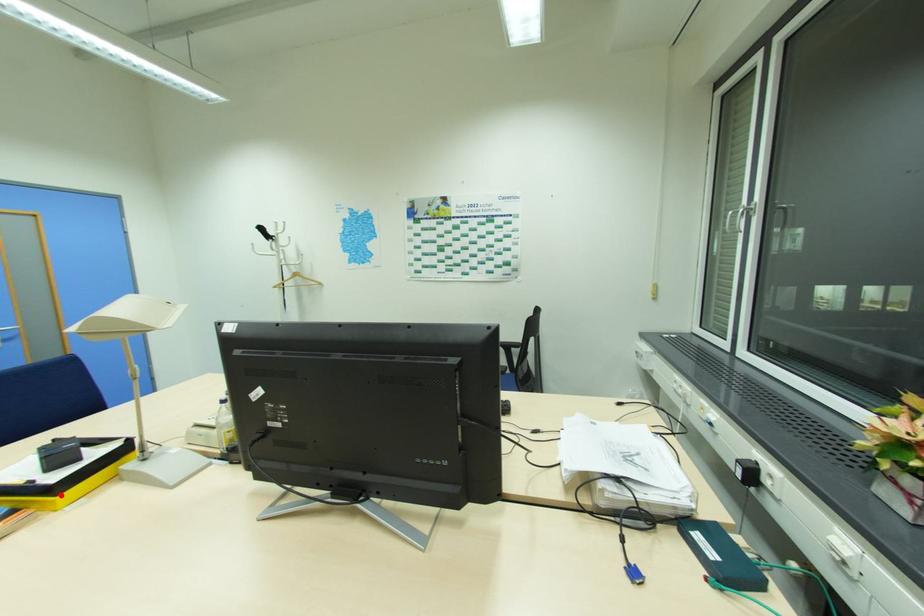
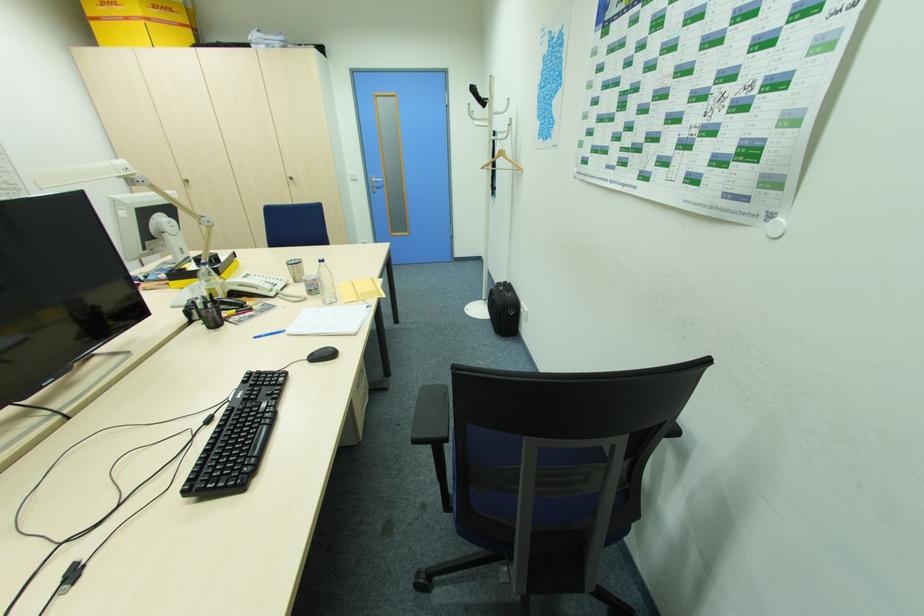
In the second image, find the point that corresponds to the highlighted location in the first image.

(173, 281)